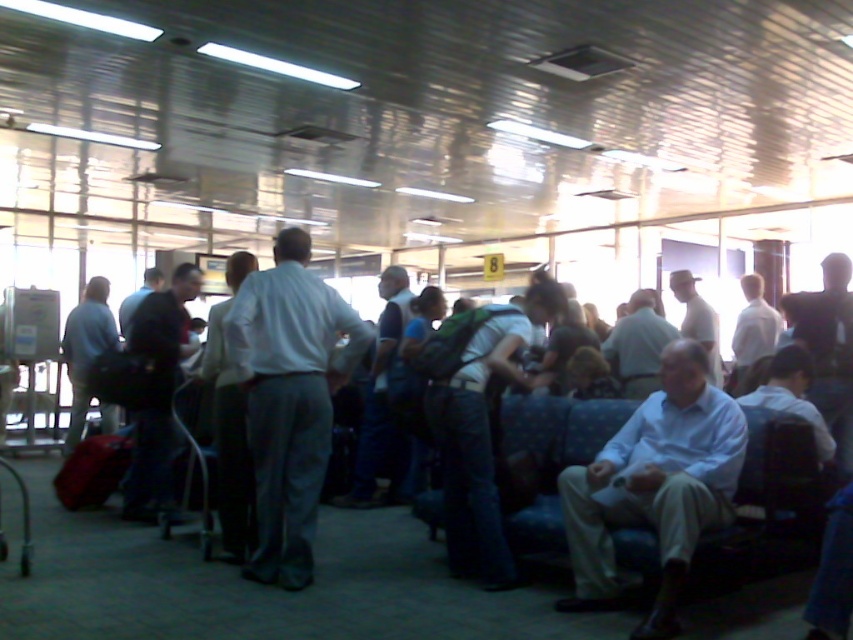
You are standing at the entrance of the airport terminal and see a white shirt at center and a light blue shirt at center. If you want to greet both people, which one should you approach first to minimize the total distance walked?

You should approach the white shirt at center first because it is closer to you than the light blue shirt at center. The white shirt at center is only 4.16 meters away from the light blue shirt at center, so moving to the closer one first minimizes the total distance walked.

You are standing at the entrance of the airport terminal and want to locate the white shirt at center. Based on the coordinates provided, can you estimate its location relative to the entrance?

The white shirt at center is located at coordinates point (654, 486), which places it approximately in the central area of the terminal, likely in the middle section of the waiting area. Since the entrance is typically at the front, the shirt would be positioned further inward from the entrance towards the center of the space.

You are a photographer standing in the airport terminal and want to take a photo of both the white shirt at center and the light blue shirt at center. Which shirt should you focus on first if you want to ensure both are in the frame without moving the camera?

You should focus on the white shirt at center first because it is shorter than the light blue shirt at center, allowing you to frame both by adjusting the camera angle to include the taller light blue shirt at center.